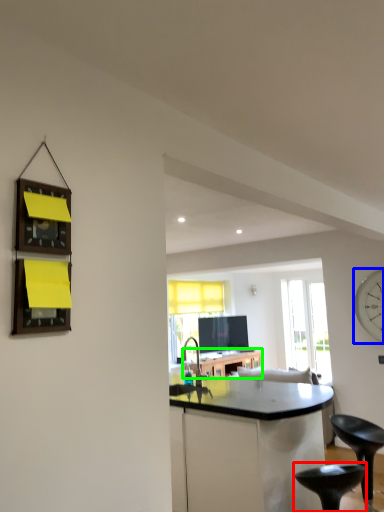
Question: Which object is positioned farthest from stool (highlighted by a red box)? Select from clock (highlighted by a blue box) and table (highlighted by a green box).

Choices:
 (A) clock
 (B) table

Answer: (B)